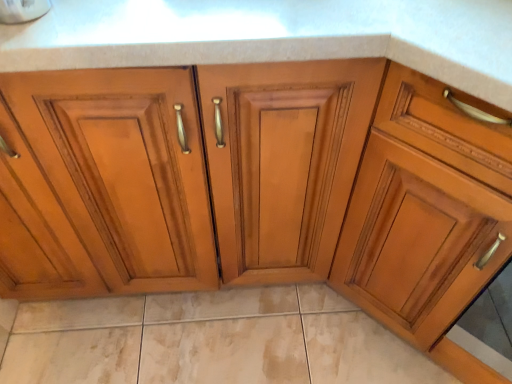
The height and width of the screenshot is (384, 512). In order to click on beige marble tile at lower center in this screenshot , I will do `click(209, 340)`.

The image size is (512, 384). Describe the element at coordinates (209, 340) in the screenshot. I see `beige marble tile at lower center` at that location.

I want to click on matte wood cabinet at right, so click(425, 210).

Describe the element at coordinates (425, 210) in the screenshot. The height and width of the screenshot is (384, 512). I see `matte wood cabinet at right` at that location.

Identify the location of beige marble tile at lower center. The height and width of the screenshot is (384, 512). (209, 340).

Considering the positions of objects matte wood cabinet at right and beige marble tile at lower center in the image provided, who is more to the left, matte wood cabinet at right or beige marble tile at lower center?

From the viewer's perspective, beige marble tile at lower center appears more on the left side.

Is matte wood cabinet at right positioned in front of beige marble tile at lower center?

Yes, it is in front of beige marble tile at lower center.

Which is less distant, (x=366, y=282) or (x=371, y=381)?

Point (x=366, y=282) appears to be closer to the viewer than point (x=371, y=381).

In the scene shown: From the image's perspective, is matte wood cabinet at right under beige marble tile at lower center?

No, from the image's perspective, matte wood cabinet at right is not below beige marble tile at lower center.

From a real-world perspective, between matte wood cabinet at right and beige marble tile at lower center, who is vertically higher?

In real-world perspective, matte wood cabinet at right is above.

Does matte wood cabinet at right have a lesser width compared to beige marble tile at lower center?

In fact, matte wood cabinet at right might be wider than beige marble tile at lower center.

Does matte wood cabinet at right have a greater height compared to beige marble tile at lower center?

Yes, matte wood cabinet at right is taller than beige marble tile at lower center.

Which of these two, matte wood cabinet at right or beige marble tile at lower center, is bigger?

Bigger between the two is matte wood cabinet at right.

Is matte wood cabinet at right not within beige marble tile at lower center?

Yes.

Are matte wood cabinet at right and beige marble tile at lower center making contact?

matte wood cabinet at right and beige marble tile at lower center are clearly separated.

Based on the photo, is beige marble tile at lower center at the back of matte wood cabinet at right?

matte wood cabinet at right is not turned away from beige marble tile at lower center.

Measure the distance from matte wood cabinet at right to beige marble tile at lower center.

A distance of 19.11 inches exists between matte wood cabinet at right and beige marble tile at lower center.

Where is `cabinetry on the right of beige marble tile at lower center`? cabinetry on the right of beige marble tile at lower center is located at coordinates (425, 210).

Is beige marble tile at lower center to the left of matte wood cabinet at right from the viewer's perspective?

Indeed, beige marble tile at lower center is positioned on the left side of matte wood cabinet at right.

Considering the relative positions of beige marble tile at lower center and matte wood cabinet at right in the image provided, is beige marble tile at lower center behind matte wood cabinet at right?

Yes, the depth of beige marble tile at lower center is greater than that of matte wood cabinet at right.

Which is more distant, (x=71, y=345) or (x=424, y=282)?

The point (x=71, y=345) is farther.

From the image's perspective, is beige marble tile at lower center above or below matte wood cabinet at right?

Clearly, from the image's perspective, beige marble tile at lower center is below matte wood cabinet at right.

From a real-world perspective, is beige marble tile at lower center physically located above or below matte wood cabinet at right?

In terms of real-world spatial position, beige marble tile at lower center is below matte wood cabinet at right.

Which object is thinner, beige marble tile at lower center or matte wood cabinet at right?

With smaller width is beige marble tile at lower center.

Considering the sizes of beige marble tile at lower center and matte wood cabinet at right in the image, is beige marble tile at lower center taller or shorter than matte wood cabinet at right?

Clearly, beige marble tile at lower center is shorter compared to matte wood cabinet at right.

Looking at this image, who is smaller, beige marble tile at lower center or matte wood cabinet at right?

Smaller between the two is beige marble tile at lower center.

Can matte wood cabinet at right be found inside beige marble tile at lower center?

No, matte wood cabinet at right is located outside of beige marble tile at lower center.

Is the surface of beige marble tile at lower center in direct contact with matte wood cabinet at right?

No, beige marble tile at lower center is not beside matte wood cabinet at right.

Does beige marble tile at lower center turn towards matte wood cabinet at right?

No, beige marble tile at lower center is not aimed at matte wood cabinet at right.

Can you tell me how much beige marble tile at lower center and matte wood cabinet at right differ in facing direction?

The angular difference between beige marble tile at lower center and matte wood cabinet at right is 45 degrees.

At what (x,y) coordinates should I click in order to perform the action: click on cabinetry in front of the beige marble tile at lower center. Please return your answer as a coordinate pair (x, y). The width and height of the screenshot is (512, 384). Looking at the image, I should click on coord(425,210).

Locate an element on the screen. The image size is (512, 384). granite that appears below the matte wood cabinet at right (from a real-world perspective) is located at coordinates (209, 340).

Where is `granite below the matte wood cabinet at right (from the image's perspective)`? The width and height of the screenshot is (512, 384). granite below the matte wood cabinet at right (from the image's perspective) is located at coordinates (209, 340).